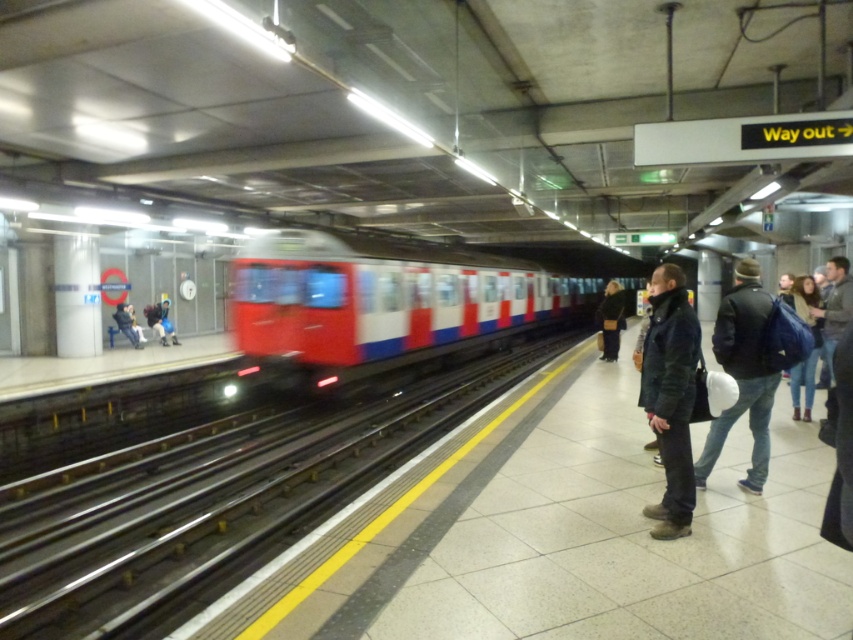
Which is more to the right, red/white/blue metal train at center or denim jacket at right?

denim jacket at right

Is red/white/blue metal train at center to the right of denim jacket at right from the viewer's perspective?

No, red/white/blue metal train at center is not to the right of denim jacket at right.

Find the location of a particular element. The height and width of the screenshot is (640, 853). red/white/blue metal train at center is located at coordinates [398, 304].

Is point (664, 493) farther from camera compared to point (129, 333)?

No, it is in front of (129, 333).

Can you confirm if dark green jacket at center is thinner than dark blue jacket at left?

Correct, dark green jacket at center's width is less than dark blue jacket at left's.

Find the location of `dark green jacket at center`. dark green jacket at center is located at coordinates (670, 396).

In order to click on dark green jacket at center in this screenshot , I will do `click(670, 396)`.

Consider the image. Can you confirm if dark blue jacket at right is wider than dark blue jacket at left?

No.

Who is shorter, dark blue jacket at right or dark blue jacket at left?

With less height is dark blue jacket at left.

Does point (817, 340) lie in front of point (115, 305)?

That is True.

You are a GUI agent. You are given a task and a screenshot of the screen. Output one action in this format:
    pyautogui.click(x=<x>, y=<y>)
    Task: Click on the dark blue jacket at right
    
    Given the screenshot: What is the action you would take?
    pyautogui.click(x=805, y=304)